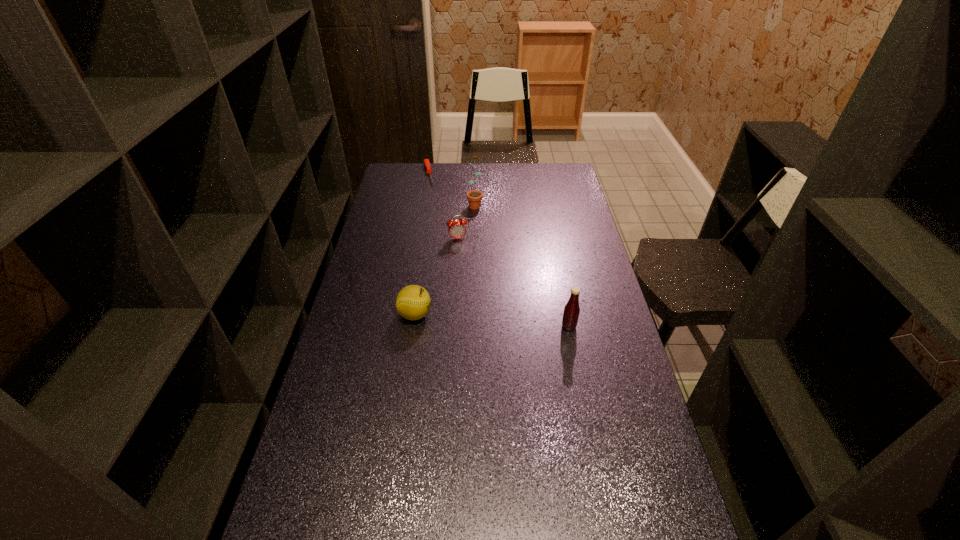
Where is `object present at the right edge`? object present at the right edge is located at coordinates (571, 311).

Locate an element on the screen. Image resolution: width=960 pixels, height=540 pixels. vacant area at the far edge is located at coordinates (466, 178).

Find the location of a particular element. The width and height of the screenshot is (960, 540). free space at the near edge is located at coordinates (508, 530).

In order to click on vacant area at the left edge in this screenshot , I will do `click(360, 260)`.

The width and height of the screenshot is (960, 540). I want to click on free space at the right edge, so click(588, 369).

The image size is (960, 540). Find the location of `free space at the far left corner of the desktop`. free space at the far left corner of the desktop is located at coordinates (406, 170).

The height and width of the screenshot is (540, 960). I want to click on vacant position at the near right corner of the desktop, so click(615, 518).

Locate an element on the screen. vacant space in between the shortest object and the second farthest object is located at coordinates (451, 188).

At what (x,y) coordinates should I click in order to perform the action: click on vacant space that's between the softball and the third farthest object. Please return your answer as a coordinate pair (x, y). Image resolution: width=960 pixels, height=540 pixels. Looking at the image, I should click on (437, 276).

Where is `empty space that is in between the farthest object and the fourth nearest object`? empty space that is in between the farthest object and the fourth nearest object is located at coordinates (451, 188).